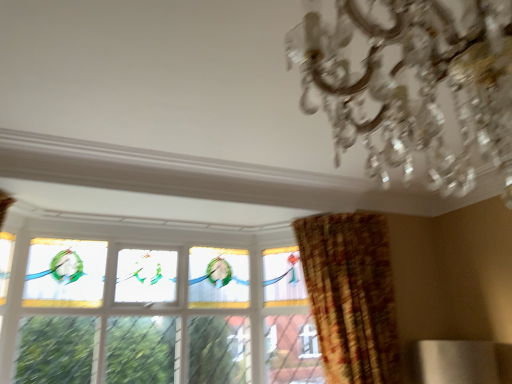
Question: From a real-world perspective, is stained glass window at center beneath plaid fabric curtain at right?

Choices:
 (A) no
 (B) yes

Answer: (A)

Question: Does stained glass window at center lie behind plaid fabric curtain at right?

Choices:
 (A) yes
 (B) no

Answer: (A)

Question: Is stained glass window at center to the left of plaid fabric curtain at right from the viewer's perspective?

Choices:
 (A) yes
 (B) no

Answer: (A)

Question: Is plaid fabric curtain at right completely or partially inside stained glass window at center?

Choices:
 (A) yes
 (B) no

Answer: (B)

Question: Is stained glass window at center taller than plaid fabric curtain at right?

Choices:
 (A) no
 (B) yes

Answer: (B)

Question: Is stained glass window at center smaller than plaid fabric curtain at right?

Choices:
 (A) no
 (B) yes

Answer: (B)

Question: From a real-world perspective, is plaid fabric curtain at right physically above stained glass window at center?

Choices:
 (A) no
 (B) yes

Answer: (A)

Question: Can you confirm if plaid fabric curtain at right is bigger than stained glass window at center?

Choices:
 (A) yes
 (B) no

Answer: (A)

Question: Is stained glass window at center at the back of plaid fabric curtain at right?

Choices:
 (A) no
 (B) yes

Answer: (A)

Question: From the image's perspective, is plaid fabric curtain at right below stained glass window at center?

Choices:
 (A) no
 (B) yes

Answer: (A)

Question: Does plaid fabric curtain at right have a smaller size compared to stained glass window at center?

Choices:
 (A) no
 (B) yes

Answer: (A)

Question: Is plaid fabric curtain at right next to stained glass window at center?

Choices:
 (A) no
 (B) yes

Answer: (A)

Question: Is plaid fabric curtain at right completely or partially inside clear crystal chandelier at upper right?

Choices:
 (A) no
 (B) yes

Answer: (A)